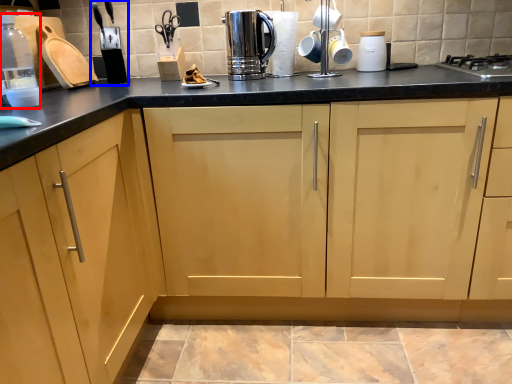
Question: Which object is further to the camera taking this photo, bottle (highlighted by a red box) or appliance (highlighted by a blue box)?

Choices:
 (A) bottle
 (B) appliance

Answer: (B)